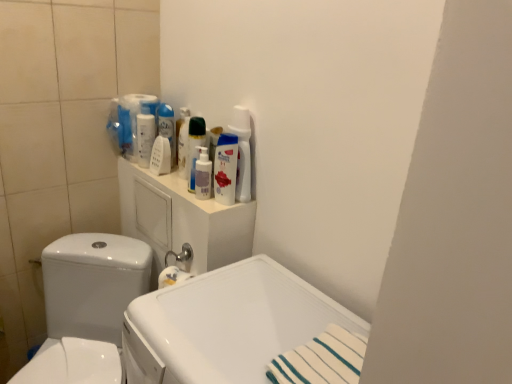
Identify the location of unoccupied area in front of white glossy spray bottle at upper center, which is the 4th cleaning product from right to left. The width and height of the screenshot is (512, 384). (164, 180).